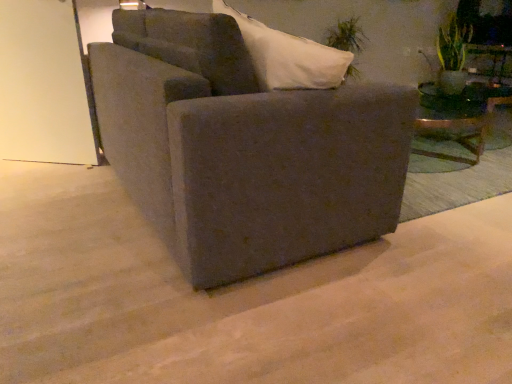
Where is `free space in front of transparent glass door at upper left`? free space in front of transparent glass door at upper left is located at coordinates pos(41,180).